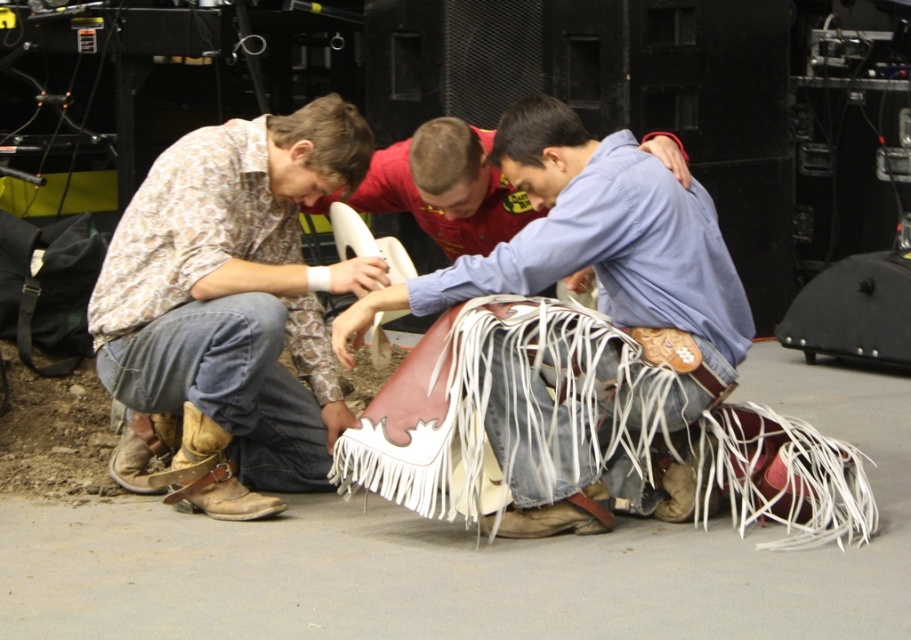
Is camouflage shirt at left positioned behind brown leather cowboy boot at lower left?

No, it is in front of brown leather cowboy boot at lower left.

Is point (203, 420) positioned behind point (269, 506)?

No.

The width and height of the screenshot is (911, 640). What are the coordinates of `camouflage shirt at left` in the screenshot? It's located at (234, 304).

In the scene shown: Is leather fringe skirt at center shorter than brown leather cowboy boot at lower left?

No.

Between leather fringe skirt at center and brown leather cowboy boot at lower left, which one is positioned lower?

brown leather cowboy boot at lower left is lower down.

Who is more distant from viewer, (536, 132) or (191, 480)?

The point (191, 480) is behind.

Where is `leather fringe skirt at center`? The height and width of the screenshot is (640, 911). leather fringe skirt at center is located at coordinates (589, 237).

Is camouflage shirt at left above leather fringe skirt at center?

No, camouflage shirt at left is not above leather fringe skirt at center.

Between point (193, 497) and point (478, 291), which one is positioned behind?

The point (193, 497) is behind.

Measure the distance between point (147, 387) and camera.

Point (147, 387) is 4.38 meters from camera.

This screenshot has width=911, height=640. Find the location of `camouflage shirt at left`. camouflage shirt at left is located at coordinates (234, 304).